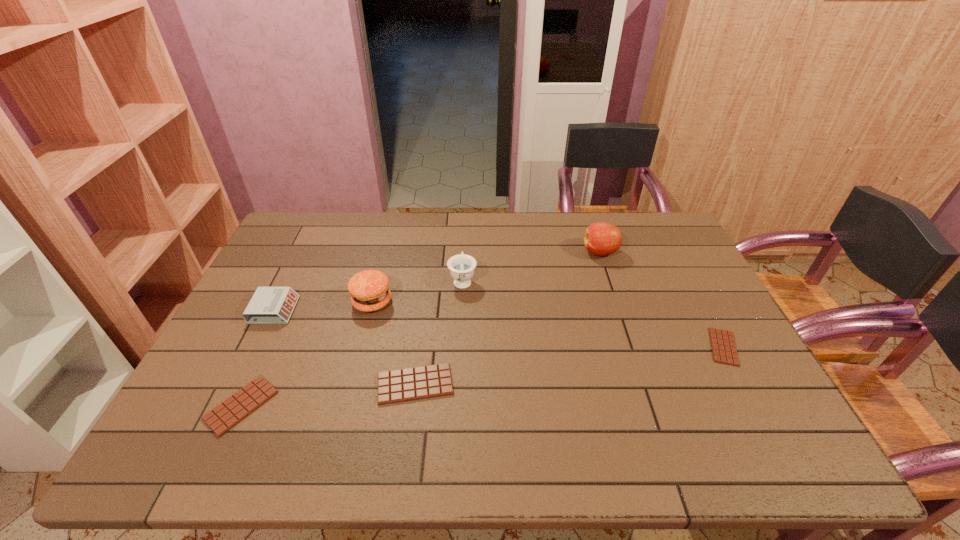
To ensure equal spacing by inserting another candy_bar among them, please point out a vacant spot for this new candy_bar. Please provide its 2D coordinates. Your answer should be formatted as a tuple, i.e. [(x, y)], where the tuple contains the x and y coordinates of a point satisfying the conditions above.

[(575, 365)]